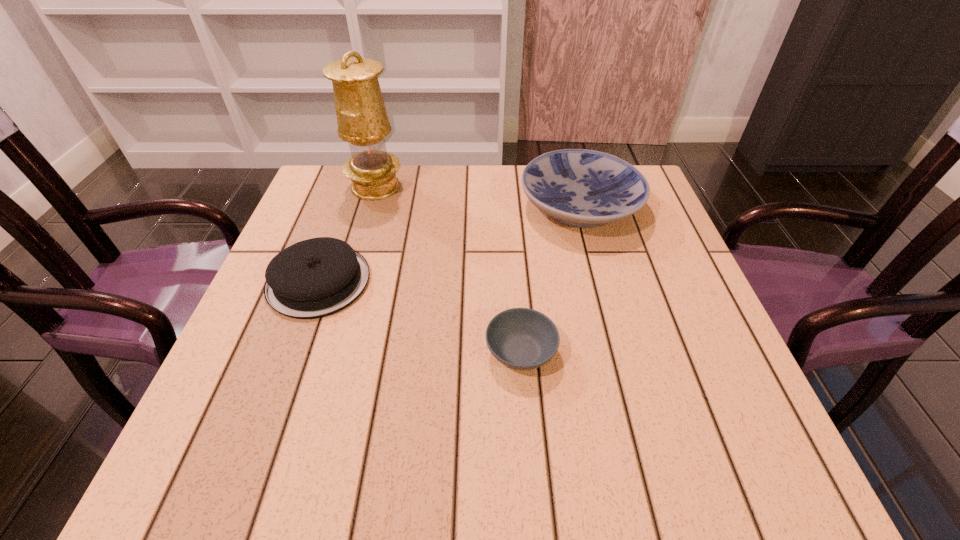
The height and width of the screenshot is (540, 960). I want to click on vacant area that lies between the tallest object and the nearest object, so click(x=448, y=269).

Identify which object is the second closest to the oil lamp. Please provide its 2D coordinates. Your answer should be formatted as a tuple, i.e. [(x, y)], where the tuple contains the x and y coordinates of a point satisfying the conditions above.

[(583, 188)]

Locate an element on the screen. the third closest object to the shortest object is located at coordinates (362, 120).

This screenshot has width=960, height=540. Identify the location of vacant region that satisfies the following two spatial constraints: 1. on the back side of the second tallest object; 2. on the right side of the pancake. (346, 207).

You are a GUI agent. You are given a task and a screenshot of the screen. Output one action in this format:
    pyautogui.click(x=<x>, y=<y>)
    Task: Click on the vacant space that satisfies the following two spatial constraints: 1. on the front side of the tallest object; 2. on the left side of the plate
    
    Given the screenshot: What is the action you would take?
    pyautogui.click(x=370, y=207)